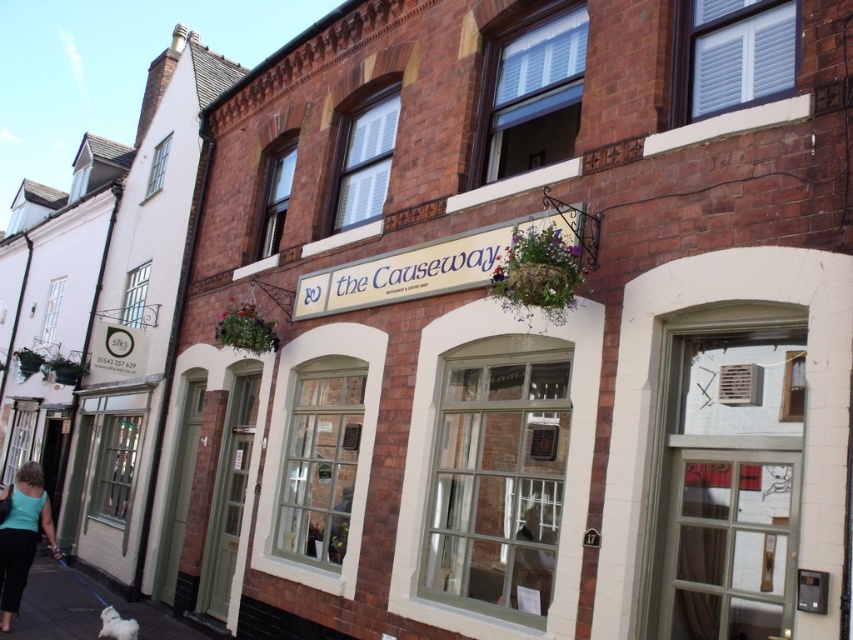
Which is behind, point (12, 618) or point (132, 628)?

The point (12, 618) is more distant.

Is teal fabric top at lower left above white fluffy dog at lower left?

Yes, teal fabric top at lower left is above white fluffy dog at lower left.

The width and height of the screenshot is (853, 640). Find the location of `teal fabric top at lower left`. teal fabric top at lower left is located at coordinates (21, 536).

Where is `teal fabric top at lower left`? teal fabric top at lower left is located at coordinates (21, 536).

Can you confirm if black asphalt pavement at lower left is positioned above teal fabric top at lower left?

No, black asphalt pavement at lower left is not above teal fabric top at lower left.

Does point (25, 627) come in front of point (30, 518)?

Yes, point (25, 627) is closer to viewer.

Locate an element on the screen. black asphalt pavement at lower left is located at coordinates (54, 604).

Which is more to the right, black asphalt pavement at lower left or white fluffy dog at lower left?

From the viewer's perspective, white fluffy dog at lower left appears more on the right side.

Is point (59, 627) closer to camera compared to point (120, 625)?

That is False.

You are a GUI agent. You are given a task and a screenshot of the screen. Output one action in this format:
    pyautogui.click(x=<x>, y=<y>)
    Task: Click on the black asphalt pavement at lower left
    The width and height of the screenshot is (853, 640).
    Given the screenshot: What is the action you would take?
    pyautogui.click(x=54, y=604)